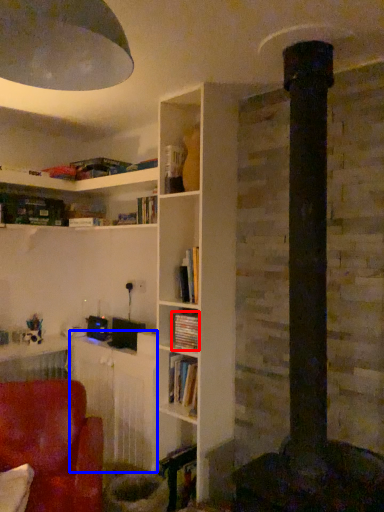
Question: Which of the following is the closest to the observer, book (highlighted by a red box) or table (highlighted by a blue box)?

Choices:
 (A) book
 (B) table

Answer: (A)